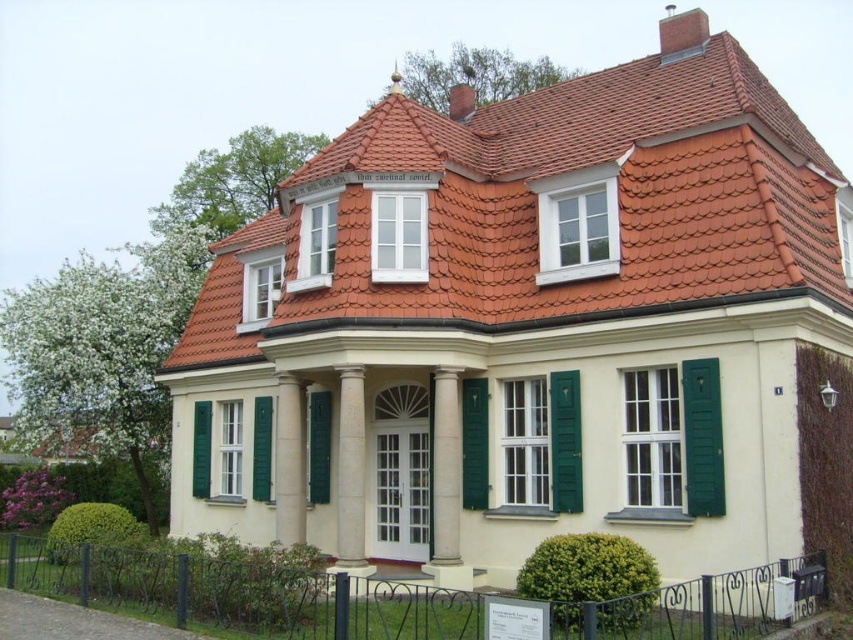
Question: Does black wrought iron fence at lower left have a greater width compared to green matte shutter at center?

Choices:
 (A) no
 (B) yes

Answer: (B)

Question: Which point is closer to the camera?

Choices:
 (A) (778, 570)
 (B) (254, 452)

Answer: (A)

Question: Can you confirm if terracotta clay tiles at upper center is positioned above white smooth column at center?

Choices:
 (A) no
 (B) yes

Answer: (B)

Question: Which of these objects is positioned farthest from the white smooth column at center?

Choices:
 (A) black wrought iron fence at lower left
 (B) green matte shutter at center

Answer: (A)

Question: Is green matte shutter at center smaller than green matte shutter at left?

Choices:
 (A) no
 (B) yes

Answer: (A)

Question: Which point appears farthest from the camera in this image?

Choices:
 (A) (270, 438)
 (B) (640, 605)
 (C) (312, 499)

Answer: (A)